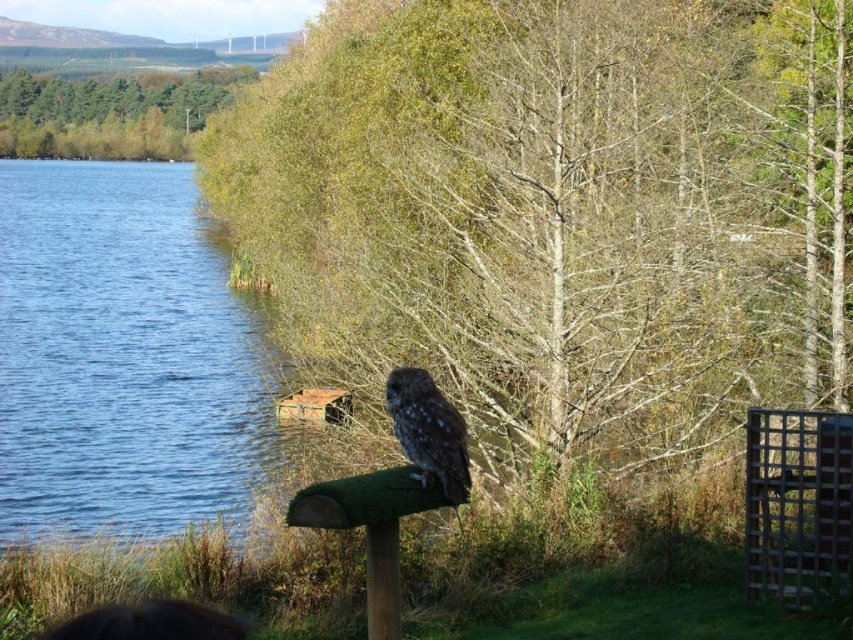
You are a GUI agent. You are given a task and a screenshot of the screen. Output one action in this format:
    pyautogui.click(x=<x>, y=<y>)
    Task: Click on the blue water at left
    The height and width of the screenshot is (640, 853).
    Given the screenshot: What is the action you would take?
    pyautogui.click(x=122, y=356)

Is point (134, 435) closer to camera compared to point (18, 81)?

Yes, point (134, 435) is closer to viewer.

At what (x,y) coordinates should I click in order to perform the action: click on blue water at left. Please return your answer as a coordinate pair (x, y). The image size is (853, 640). Looking at the image, I should click on (122, 356).

This screenshot has height=640, width=853. I want to click on blue water at left, so click(x=122, y=356).

Which is behind, point (56, 173) or point (399, 403)?

The point (56, 173) is more distant.

Is point (13, 515) positioned after point (434, 401)?

Yes, it is behind point (434, 401).

This screenshot has width=853, height=640. I want to click on blue water at left, so coord(122,356).

Who is positioned more to the left, green leafy trees at upper left or speckled brown owl at center?

green leafy trees at upper left

Is green leafy trees at upper left to the right of speckled brown owl at center from the viewer's perspective?

No, green leafy trees at upper left is not to the right of speckled brown owl at center.

Is point (129, 77) farther from camera compared to point (425, 422)?

Yes.

Identify the location of green leafy trees at upper left. This screenshot has width=853, height=640. (109, 113).